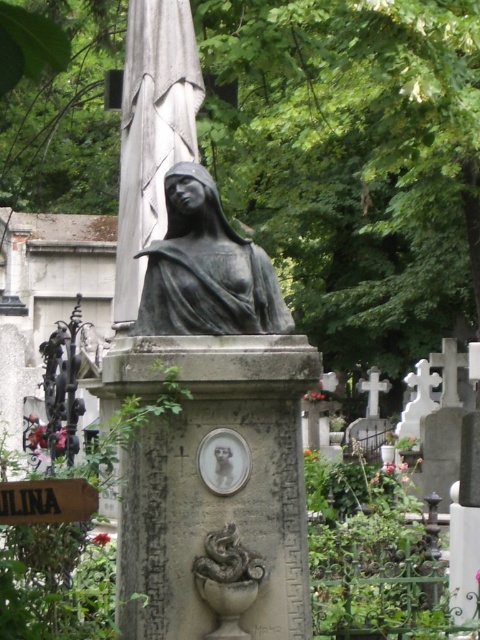
Question: Which point is closer to the camera taking this photo?

Choices:
 (A) (240, 300)
 (B) (60, 508)

Answer: (B)

Question: Is bronze statue at center closer to the viewer compared to brown wood sign at lower left?

Choices:
 (A) no
 (B) yes

Answer: (A)

Question: Is bronze statue at center smaller than brown wood sign at lower left?

Choices:
 (A) yes
 (B) no

Answer: (B)

Question: Which of the following is the closest to the observer?

Choices:
 (A) brown wood sign at lower left
 (B) bronze statue at center

Answer: (A)

Question: Which object appears closest to the camera in this image?

Choices:
 (A) brown wood sign at lower left
 (B) bronze statue at center

Answer: (A)

Question: Is bronze statue at center positioned behind brown wood sign at lower left?

Choices:
 (A) no
 (B) yes

Answer: (B)